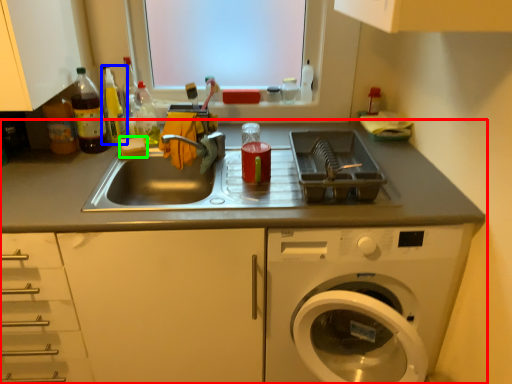
Question: Which is nearer to the countertop (highlighted by a red box)? bottle (highlighted by a blue box) or food (highlighted by a green box).

Choices:
 (A) bottle
 (B) food

Answer: (B)